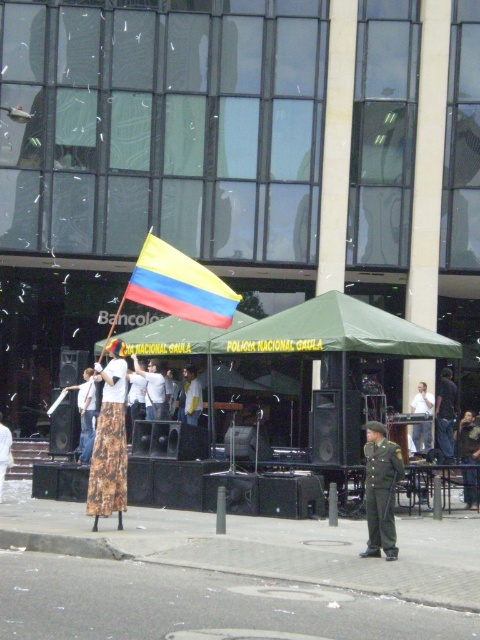
Can you confirm if white cotton shirt at center is smaller than floral skirt at center?

Yes, white cotton shirt at center is smaller than floral skirt at center.

Which is above, white cotton shirt at center or floral skirt at center?

Positioned higher is white cotton shirt at center.

What do you see at coordinates (153, 388) in the screenshot? I see `white cotton shirt at center` at bounding box center [153, 388].

Find the location of a particular element. The image size is (480, 640). white cotton shirt at center is located at coordinates (153, 388).

Is printed fabric skirt at center closer to the viewer compared to dark blue uniform at center?

Yes, printed fabric skirt at center is in front of dark blue uniform at center.

Does point (111, 362) come closer to viewer compared to point (444, 452)?

Yes, point (111, 362) is closer to viewer.

Measure the distance between printed fabric skirt at center and camera.

printed fabric skirt at center is 9.71 meters away from camera.

The width and height of the screenshot is (480, 640). Identify the location of printed fabric skirt at center. (109, 442).

Is green uniform at center positioned in front of dark blue uniform at center?

Yes, it is in front of dark blue uniform at center.

Who is shorter, green uniform at center or dark blue uniform at center?

green uniform at center

Is point (380, 477) closer to camera compared to point (452, 420)?

Yes, point (380, 477) is closer to viewer.

Identify the location of green uniform at center. The width and height of the screenshot is (480, 640). (381, 490).